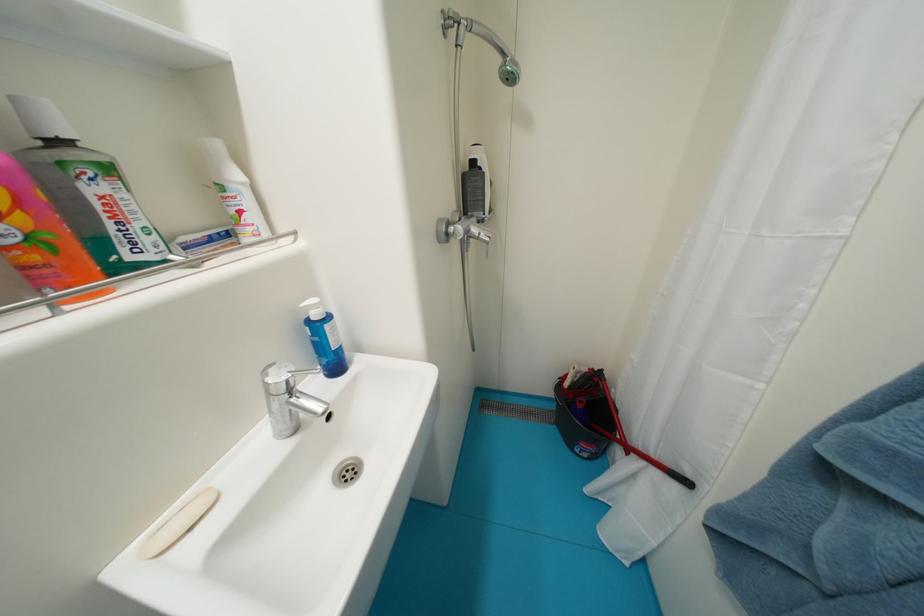
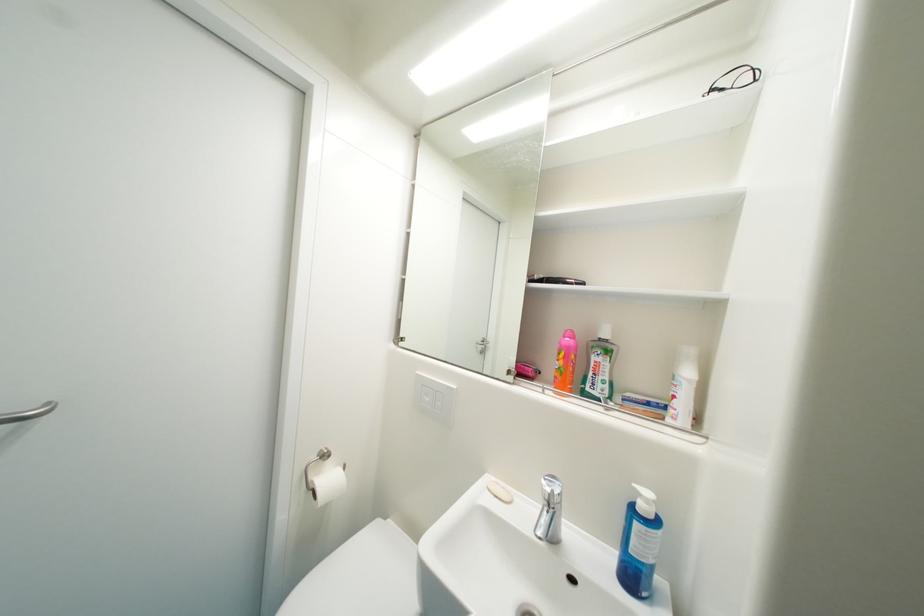
In the second image, find the point that corresponds to the point at 188,241 in the first image.

(635, 397)